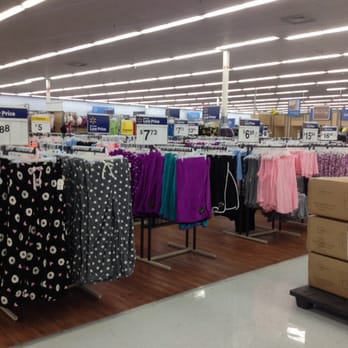
This screenshot has width=348, height=348. In order to click on vents in this screenshot , I will do `click(294, 19)`, `click(72, 62)`.